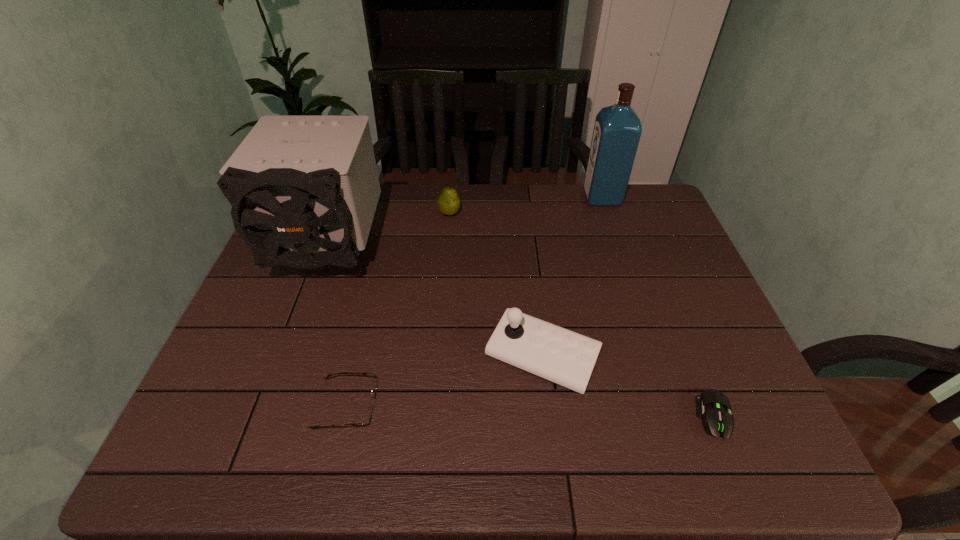
Find the location of `object at the left edge`. object at the left edge is located at coordinates (304, 189).

Locate an element on the screen. The width and height of the screenshot is (960, 540). liquor at the right edge is located at coordinates (617, 130).

Identify the location of computer mouse located in the right edge section of the desktop. (717, 417).

Locate an element on the screen. This screenshot has height=540, width=960. object that is at the far left corner is located at coordinates (304, 189).

This screenshot has width=960, height=540. I want to click on object that is at the far right corner, so click(x=617, y=130).

The image size is (960, 540). I want to click on object present at the near right corner, so click(717, 417).

You are a GUI agent. You are given a task and a screenshot of the screen. Output one action in this format:
    pyautogui.click(x=<x>, y=<y>)
    Task: Click on the vacant point at the far edge
    The width and height of the screenshot is (960, 540).
    Given the screenshot: What is the action you would take?
    pyautogui.click(x=381, y=225)

I want to click on vacant space at the near edge, so click(x=662, y=434).

You are a GUI agent. You are given a task and a screenshot of the screen. Output one action in this format:
    pyautogui.click(x=<x>, y=<y>)
    Task: Click on the vacant region at the left edge
    
    Given the screenshot: What is the action you would take?
    pyautogui.click(x=274, y=399)

The width and height of the screenshot is (960, 540). In the image, there is a desktop. Find the location of `vacant space at the right edge`. vacant space at the right edge is located at coordinates (768, 415).